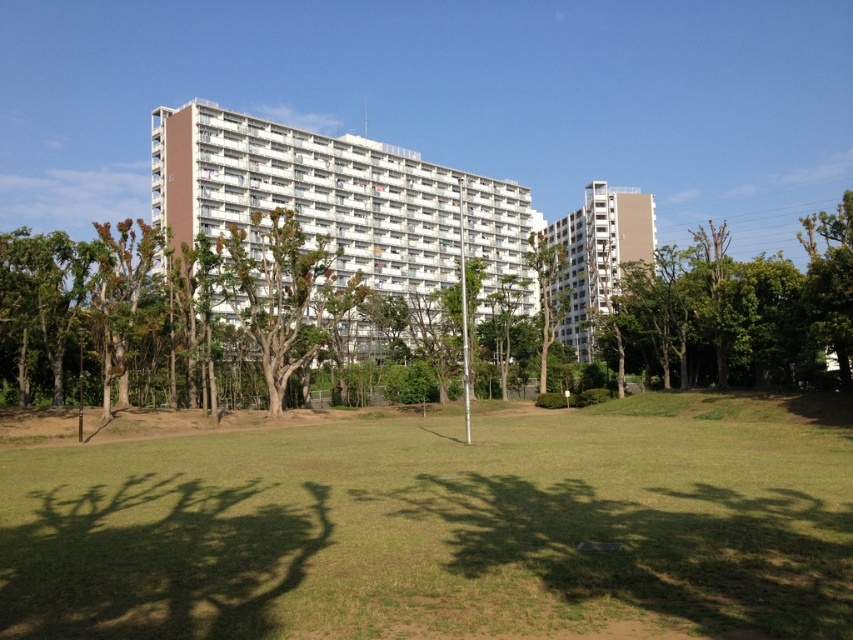
Question: Which object is farther from the camera taking this photo?

Choices:
 (A) brown textured tree at center
 (B) green leafy tree at right

Answer: (A)

Question: Does green leafy tree at right appear under white smooth building at upper right?

Choices:
 (A) no
 (B) yes

Answer: (B)

Question: Is green leafy tree at right below brown textured tree at center?

Choices:
 (A) yes
 (B) no

Answer: (B)

Question: Estimate the real-world distances between objects in this image. Which object is farther from the white smooth building at upper right?

Choices:
 (A) white smooth building at center
 (B) green leafy tree at center
 (C) green grass at center
 (D) green leafy tree at right

Answer: (C)

Question: Which point is closer to the camera?

Choices:
 (A) green leafy tree at center
 (B) brown textured tree at center

Answer: (B)

Question: Is green grass at center above green leafy tree at right?

Choices:
 (A) no
 (B) yes

Answer: (A)